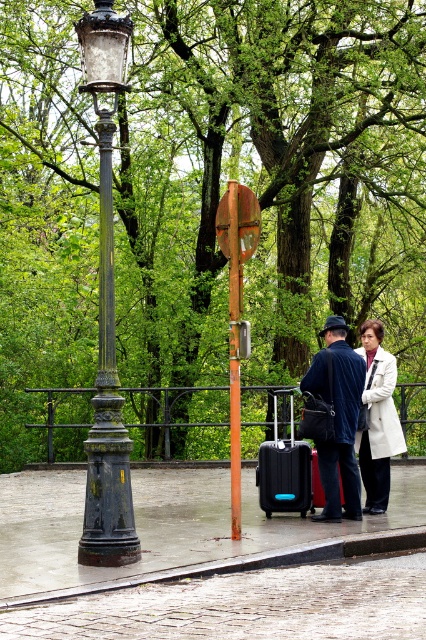
Who is positioned more to the right, black polished metal streetlamp at left or dark blue fabric coat at center?

dark blue fabric coat at center

Can you confirm if black polished metal streetlamp at left is positioned below dark blue fabric coat at center?

Actually, black polished metal streetlamp at left is above dark blue fabric coat at center.

Between point (86, 51) and point (356, 464), which one is positioned in front?

Positioned in front is point (86, 51).

Find the location of `black polished metal streetlamp at left`. black polished metal streetlamp at left is located at coordinates (106, 317).

Does concrete pavement at center have a smaller size compared to cobblestone pavement at lower center?

Actually, concrete pavement at center might be larger than cobblestone pavement at lower center.

Between concrete pavement at center and cobblestone pavement at lower center, which one appears on the left side from the viewer's perspective?

From the viewer's perspective, concrete pavement at center appears more on the left side.

What do you see at coordinates (166, 528) in the screenshot? I see `concrete pavement at center` at bounding box center [166, 528].

Where is `concrete pavement at center`? This screenshot has height=640, width=426. concrete pavement at center is located at coordinates (166, 528).

Is point (232, 490) farther from viewer compared to point (339, 474)?

No, (232, 490) is closer to viewer.

Is orange painted wood pole at center smaller than black matte suitcase at center?

No.

Image resolution: width=426 pixels, height=640 pixels. What do you see at coordinates (233, 355) in the screenshot? I see `orange painted wood pole at center` at bounding box center [233, 355].

Where is `orange painted wood pole at center`? This screenshot has height=640, width=426. orange painted wood pole at center is located at coordinates [x=233, y=355].